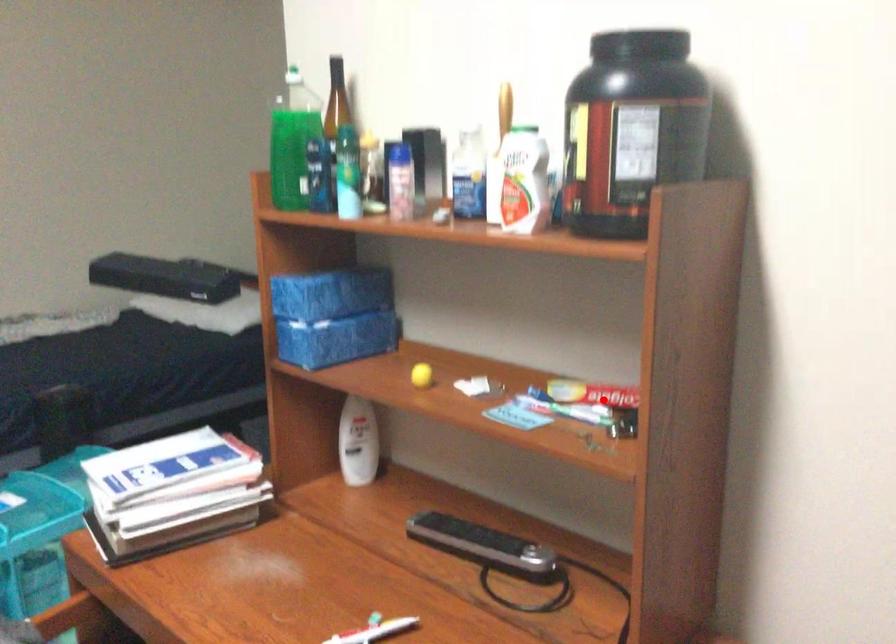
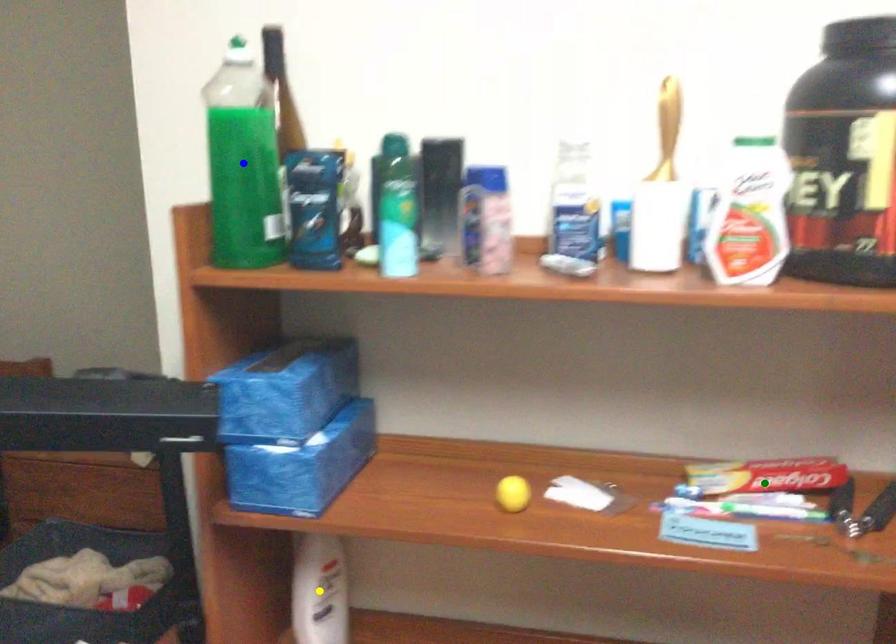
Question: I am providing you with two images of the same scene from different viewpoints. A red point is marked on the first image. You are given multiple points on the second image. In image 2, which mark is for the same physical point as the one in image 1?

Choices:
 (A) yellow point
 (B) blue point
 (C) green point

Answer: (C)